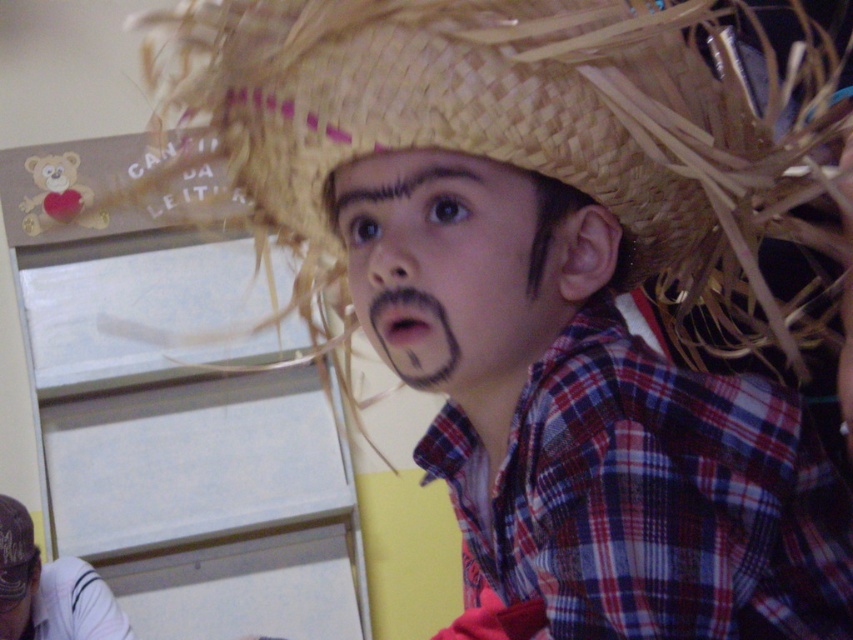
Does white striped shirt at lower left lie in front of black matte nose at center?

No.

Locate an element on the screen. The height and width of the screenshot is (640, 853). white striped shirt at lower left is located at coordinates [x=49, y=589].

Can you confirm if black matte nose at center is positioned to the left of woven straw hat at upper center?

Incorrect, black matte nose at center is not on the left side of woven straw hat at upper center.

Can you confirm if black matte nose at center is positioned below woven straw hat at upper center?

Actually, black matte nose at center is above woven straw hat at upper center.

Which is behind, point (376, 260) or point (9, 552)?

The point (9, 552) is behind.

Image resolution: width=853 pixels, height=640 pixels. I want to click on black matte nose at center, so click(x=386, y=253).

Can you confirm if matte straw hat at center is positioned to the right of woven straw hat at upper center?

Correct, you'll find matte straw hat at center to the right of woven straw hat at upper center.

Does matte straw hat at center have a greater width compared to woven straw hat at upper center?

Indeed, matte straw hat at center has a greater width compared to woven straw hat at upper center.

Which is in front, point (340, 184) or point (32, 524)?

Point (340, 184)

Locate an element on the screen. Image resolution: width=853 pixels, height=640 pixels. matte straw hat at center is located at coordinates (445, 268).